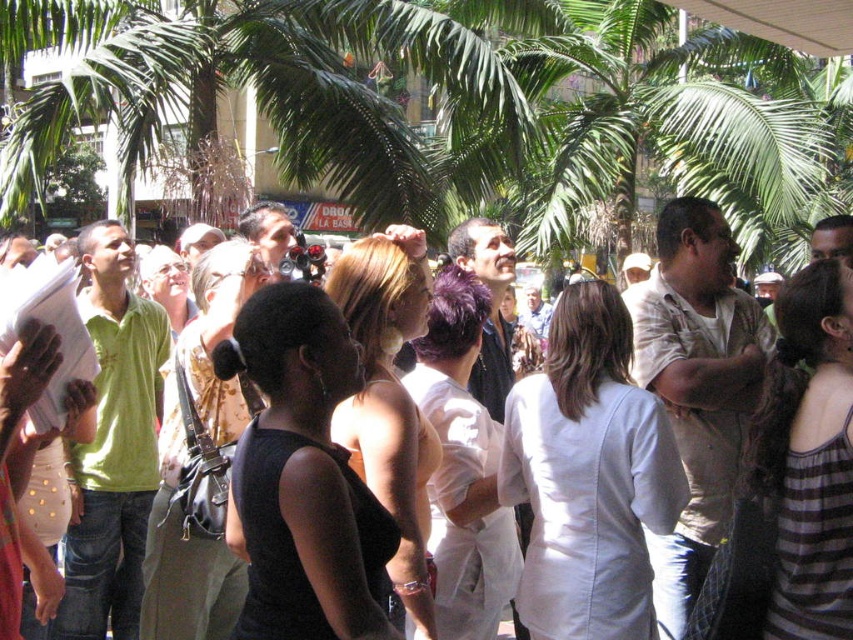
You are at the event and want to take a photo of the matte black dress at center without the green leafy palm tree at center blocking it. Which direction should you move to achieve this?

Move to the right so that the matte black dress at center is positioned to the left of the green leafy palm tree at center, thus avoiding the obstruction.

You are standing at the origin point in this outdoor scene. The green leafy palm tree at center is located at coordinates 0.161 in the x direction and 0.537 in the y direction. If you want to walk directly towards the palm tree, which direction should you move? Please provide your answer in terms of compass directions like north, south, east, or west.

A: To walk directly towards the green leafy palm tree at center located at coordinates x 0.161 and y 0.537, you should move west because the x coordinate is less than 0.5, indicating it is to the left of the center point, and the y coordinate is greater than 0.5, meaning it is above the center point. Therefore, combining these directions, moving west and north would be appropriate. However, since compass directions typically use north as the primary direction, the most accurate answer is northwestern direction

You are a photographer trying to capture a photo of the matte black dress at center without the green leafy palm tree at center blocking it. What should you do?

Since the green leafy palm tree at center is much taller than the matte black dress at center, you can lower your camera angle to avoid the tree blocking the dress.